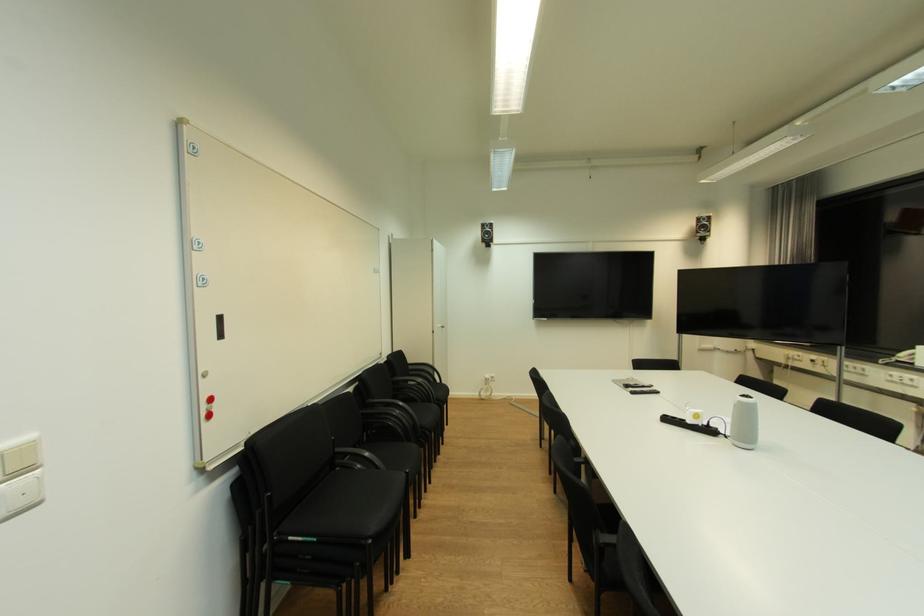
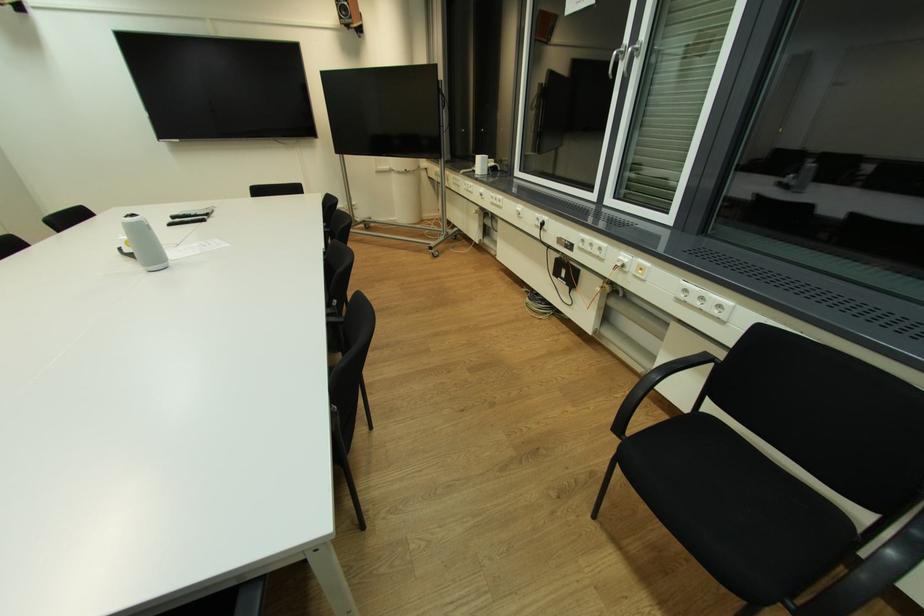
The point at (708, 231) is marked in the first image. Where is the corresponding point in the second image?

(349, 15)